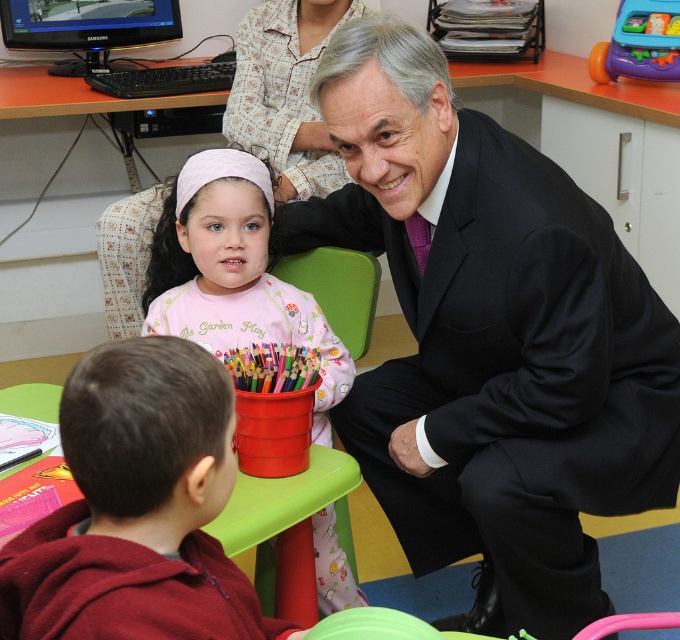
You are standing in the classroom and want to give a gift to the child wearing the maroon fleece hoodie at lower left. Based on their position in the image, which direction should you move to reach them?

The maroon fleece hoodie at lower left is located at point (137, 508), which is towards the lower left of the image. To reach the child, you should move towards the lower left direction from your current position.

In the scene shown: You are standing in the classroom scene. There is a point marked at coordinates (x=490, y=339). What object is located at this point?

The point at coordinates (x=490, y=339) corresponds to the black suit at center.

You are a photographer setting up for a group photo. You need to ensure that the black suit at center and the black glossy monitor at upper left are both in frame. Based on their sizes, which object should you prioritize positioning closer to the camera to avoid cropping?

The black suit at center might be wider than black glossy monitor at upper left, so you should prioritize positioning the black suit at center closer to the camera to avoid cropping.